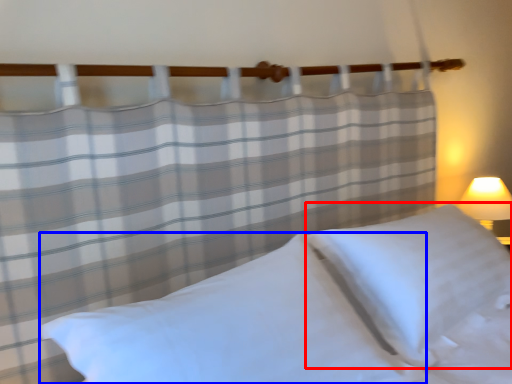
Question: Which of the following is the closest to the observer, pillow (highlighted by a red box) or pillow (highlighted by a blue box)?

Choices:
 (A) pillow
 (B) pillow

Answer: (B)